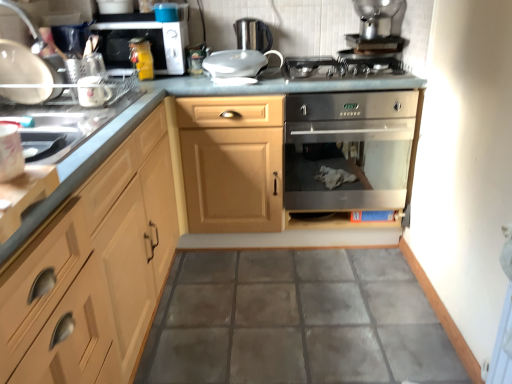
Measure the distance between light wood cabinet at left and camera.

light wood cabinet at left and camera are 25.16 inches apart.

I want to click on smooth gray countertop at center, so click(x=173, y=214).

I want to click on satin silver kettle at upper center, which is the 5th appliance from front to back, so click(253, 34).

The image size is (512, 384). Describe the element at coordinates (380, 17) in the screenshot. I see `shiny metallic pot at upper right, the first appliance in the top-to-bottom sequence` at that location.

I want to click on shiny metallic pot at upper right, the fourth appliance viewed from the front, so click(380, 17).

What do you see at coordinates (10, 151) in the screenshot? I see `white glossy mug at left, which is the 5th appliance in back-to-front order` at bounding box center [10, 151].

The width and height of the screenshot is (512, 384). What are the coordinates of `light wood cabinet at left` in the screenshot? It's located at (98, 268).

Is point (324, 282) closer or farther from the camera than point (378, 169)?

Point (324, 282) is closer to the camera than point (378, 169).

Is gray tile floor at center to the left or to the right of stainless steel oven at center in the image?

In the image, gray tile floor at center appears on the left side of stainless steel oven at center.

Choose the correct answer: Is gray tile floor at center inside stainless steel oven at center or outside it?

gray tile floor at center is outside stainless steel oven at center.

How many degrees apart are the facing directions of gray tile floor at center and stainless steel oven at center?

0.251 degrees.

Are satin silver kettle at upper center, the first appliance when ordered from back to front, and gray tile floor at center making contact?

No.

Considering the sizes of objects satin silver kettle at upper center, the first appliance when ordered from back to front, and gray tile floor at center in the image provided, who is smaller, satin silver kettle at upper center, the first appliance when ordered from back to front, or gray tile floor at center?

satin silver kettle at upper center, the first appliance when ordered from back to front.

Which is behind, point (241, 35) or point (258, 318)?

The point (241, 35) is farther.

Is satin silver kettle at upper center, marked as the fourth appliance in a left-to-right arrangement, at the right side of gray tile floor at center?

No, satin silver kettle at upper center, marked as the fourth appliance in a left-to-right arrangement, is not to the right of gray tile floor at center.

Is stainless steel gas stove at center facing towards satin silver oven at upper center?

No.

Can you confirm if stainless steel gas stove at center is positioned to the left of satin silver oven at upper center?

No.

Is stainless steel gas stove at center in front of satin silver oven at upper center?

Yes, it is in front of satin silver oven at upper center.

Based on the photo, considering the sizes of objects stainless steel gas stove at center and satin silver oven at upper center in the image provided, who is bigger, stainless steel gas stove at center or satin silver oven at upper center?

satin silver oven at upper center.

From the light wood cabinet at left, count 3rd appliances backward and point to it. Please provide its 2D coordinates.

[(237, 65)]

Which of these two, white glossy bowl at upper center, the third appliance viewed from the left, or light wood cabinet at left, is bigger?

With larger size is light wood cabinet at left.

Based on the photo, is white glossy bowl at upper center, positioned as the third appliance in back-to-front order, oriented away from light wood cabinet at left?

No, white glossy bowl at upper center, positioned as the third appliance in back-to-front order,'s orientation is not away from light wood cabinet at left.

Can you confirm if stainless steel oven at center is bigger than satin silver kettle at upper center, the first appliance when ordered from back to front?

Indeed, stainless steel oven at center has a larger size compared to satin silver kettle at upper center, the first appliance when ordered from back to front.

Could you tell me if stainless steel oven at center is turned towards satin silver kettle at upper center, the second appliance in the right-to-left sequence?

No, stainless steel oven at center does not turn towards satin silver kettle at upper center, the second appliance in the right-to-left sequence.

Which of these two, stainless steel oven at center or satin silver kettle at upper center, arranged as the fourth appliance when ordered from the bottom, is thinner?

satin silver kettle at upper center, arranged as the fourth appliance when ordered from the bottom, is thinner.

How distant is stainless steel oven at center from satin silver kettle at upper center, marked as the fourth appliance in a left-to-right arrangement?

stainless steel oven at center and satin silver kettle at upper center, marked as the fourth appliance in a left-to-right arrangement, are 28.52 inches apart from each other.

Which of these two, smooth gray countertop at center or white glossy mug at left, marked as the 1th appliance in a bottom-to-top arrangement, stands shorter?

Standing shorter between the two is white glossy mug at left, marked as the 1th appliance in a bottom-to-top arrangement.

Is smooth gray countertop at center bigger or smaller than white glossy mug at left, which is the 2th appliance in left-to-right order?

Considering their sizes, smooth gray countertop at center takes up more space than white glossy mug at left, which is the 2th appliance in left-to-right order.

Could white glossy mug at left, the 4th appliance in the right-to-left sequence, be considered to be inside smooth gray countertop at center?

No, white glossy mug at left, the 4th appliance in the right-to-left sequence, is not surrounded by smooth gray countertop at center.

From the image's perspective, would you say smooth gray countertop at center is positioned over white glossy mug at left, marked as the 1th appliance in a bottom-to-top arrangement?

No, from the image's perspective, smooth gray countertop at center is not on top of white glossy mug at left, marked as the 1th appliance in a bottom-to-top arrangement.

Is stainless steel gas stove at center surrounding white matte plate at upper left?

Actually, white matte plate at upper left is outside stainless steel gas stove at center.

From a real-world perspective, who is located higher, stainless steel gas stove at center or white matte plate at upper left?

In real-world perspective, white matte plate at upper left is above.

Considering the relative positions of stainless steel gas stove at center and white matte plate at upper left in the image provided, is stainless steel gas stove at center to the left or to the right of white matte plate at upper left?

stainless steel gas stove at center is to the right of white matte plate at upper left.

Locate an element on the screen. This screenshot has width=512, height=384. home appliance on the right of gray tile floor at center is located at coordinates (351, 148).

The height and width of the screenshot is (384, 512). Identify the location of the 1st appliance to the left of the gray tile floor at center, starting your count from the anchor. (253, 34).

Based on their spatial positions, is satin silver kettle at upper center, the first appliance when ordered from back to front, or shiny metallic pot at upper right, acting as the 2th appliance starting from the back, closer to gray tile floor at center?

The object closer to gray tile floor at center is satin silver kettle at upper center, the first appliance when ordered from back to front.

When comparing their distances from stainless steel oven at center, does satin silver oven at upper center or shiny metallic pot at upper right, the fourth appliance viewed from the front, seem further?

Based on the image, satin silver oven at upper center appears to be further to stainless steel oven at center.

Estimate the real-world distances between objects in this image. Which object is further from white glossy bowl at upper center, which ranks as the 3th appliance in bottom-to-top order, smooth gray countertop at center or white glossy mug at upper left, marked as the second appliance in a front-to-back arrangement?

white glossy mug at upper left, marked as the second appliance in a front-to-back arrangement, is positioned further to the anchor white glossy bowl at upper center, which ranks as the 3th appliance in bottom-to-top order.

From the image, which object appears to be nearer to gray tile floor at center, white glossy mug at upper left, the second appliance when ordered from bottom to top, or white glossy bowl at upper center, positioned as the third appliance in back-to-front order?

The object closer to gray tile floor at center is white glossy bowl at upper center, positioned as the third appliance in back-to-front order.

Considering their positions, is stainless steel oven at center positioned closer to light wood cabinet at left than white matte plate at upper left?

Among the two, white matte plate at upper left is located nearer to light wood cabinet at left.

Considering their positions, is gray tile floor at center positioned closer to shiny metallic pot at upper right, the fifth appliance from the bottom, than white glossy bowl at upper center, which is counted as the third appliance, starting from the top?

Based on the image, white glossy bowl at upper center, which is counted as the third appliance, starting from the top, appears to be nearer to shiny metallic pot at upper right, the fifth appliance from the bottom.

Based on the photo, when comparing their distances from satin silver kettle at upper center, marked as the fourth appliance in a left-to-right arrangement, does gray tile floor at center or satin silver oven at upper center seem further?

gray tile floor at center is positioned further to the anchor satin silver kettle at upper center, marked as the fourth appliance in a left-to-right arrangement.

Based on their spatial positions, is satin silver kettle at upper center, arranged as the 2th appliance when viewed from the top, or white glossy mug at left, marked as the 1th appliance in a bottom-to-top arrangement, further from stainless steel oven at center?

white glossy mug at left, marked as the 1th appliance in a bottom-to-top arrangement, is positioned further to the anchor stainless steel oven at center.

Find the location of `plain between white glossy mug at left, marked as the 1th appliance in a bottom-to-top arrangement, and white glossy mug at upper left, marked as the second appliance in a front-to-back arrangement, along the z-axis`. plain between white glossy mug at left, marked as the 1th appliance in a bottom-to-top arrangement, and white glossy mug at upper left, marked as the second appliance in a front-to-back arrangement, along the z-axis is located at coordinates (296, 321).

At what (x,y) coordinates should I click in order to perform the action: click on plain positioned between white glossy mug at left, the 4th appliance in the right-to-left sequence, and stainless steel gas stove at center from near to far. Please return your answer as a coordinate pair (x, y). Image resolution: width=512 pixels, height=384 pixels. Looking at the image, I should click on (296, 321).

Where is `cabinetry positioned between smooth gray countertop at center and gray tile floor at center from near to far`? This screenshot has width=512, height=384. cabinetry positioned between smooth gray countertop at center and gray tile floor at center from near to far is located at coordinates (98, 268).

Find the location of `oven between white matte plate at upper left and shiny metallic pot at upper right, the first appliance in the top-to-bottom sequence, from left to right`. oven between white matte plate at upper left and shiny metallic pot at upper right, the first appliance in the top-to-bottom sequence, from left to right is located at coordinates (147, 39).